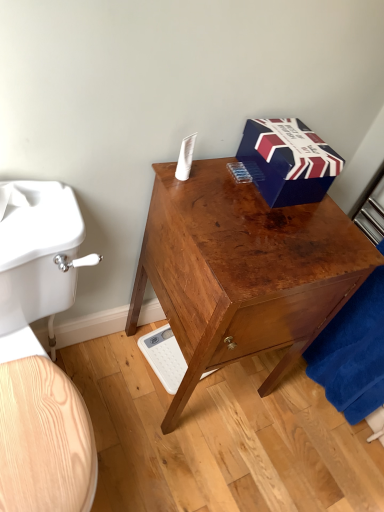
This screenshot has height=512, width=384. In order to click on vacant space in front of white plastic scale at lower center in this screenshot , I will do `click(164, 411)`.